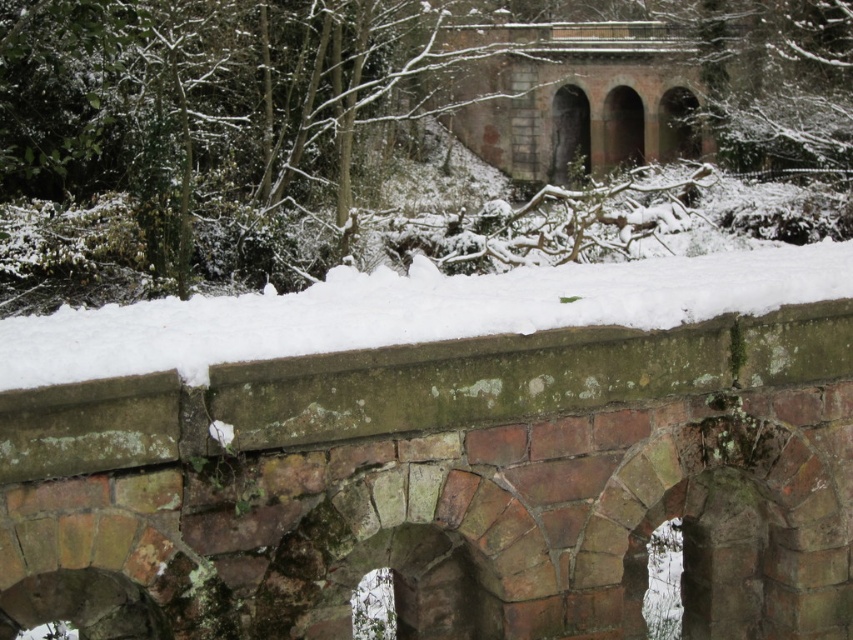
Question: Among these points, which one is nearest to the camera?

Choices:
 (A) (x=567, y=320)
 (B) (x=724, y=152)

Answer: (A)

Question: Which point is farther to the camera?

Choices:
 (A) (28, 387)
 (B) (635, 92)

Answer: (B)

Question: Is green leafy tree at center in front of white powdery snow at center?

Choices:
 (A) no
 (B) yes

Answer: (A)

Question: Among these objects, which one is nearest to the camera?

Choices:
 (A) green leafy tree at center
 (B) white powdery snow at center

Answer: (B)

Question: Is green leafy tree at center closer to camera compared to white powdery snow at center?

Choices:
 (A) no
 (B) yes

Answer: (A)

Question: From the image, what is the correct spatial relationship of green leafy tree at center in relation to white powdery snow at center?

Choices:
 (A) below
 (B) above

Answer: (B)